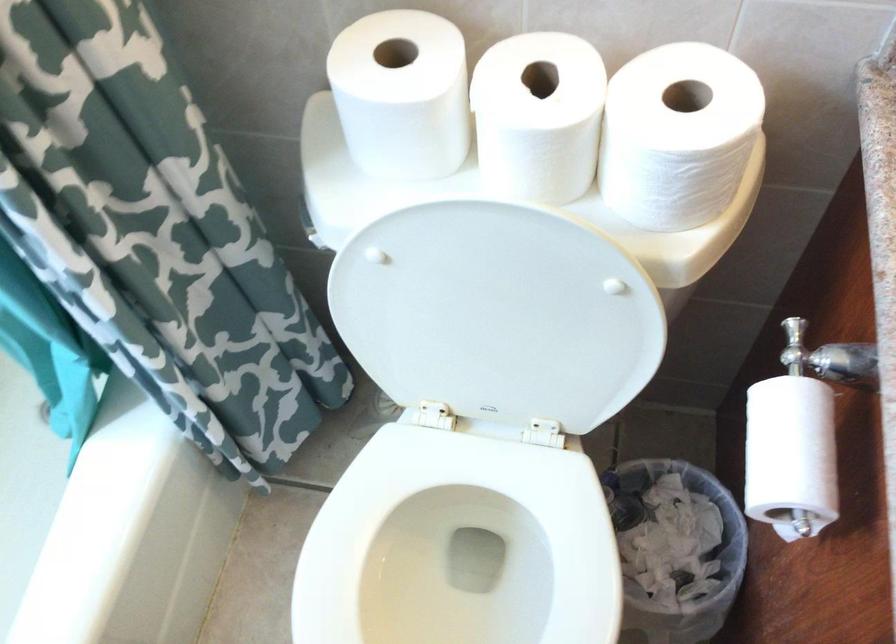
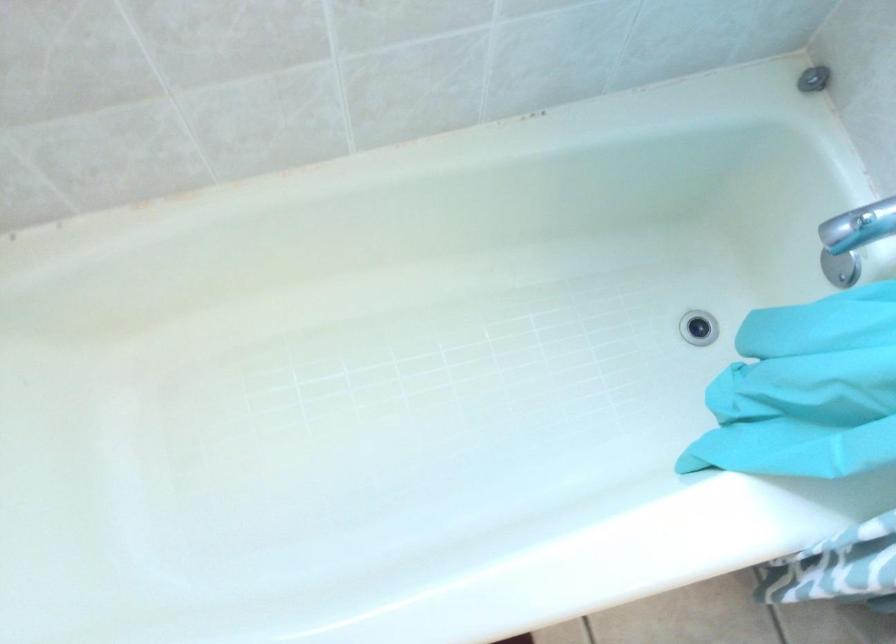
Question: Based on the continuous images, in which direction is the camera rotating? Reply with the corresponding letter.

Choices:
 (A) Left
 (B) Right
 (C) Up
 (D) Down

Answer: (D)